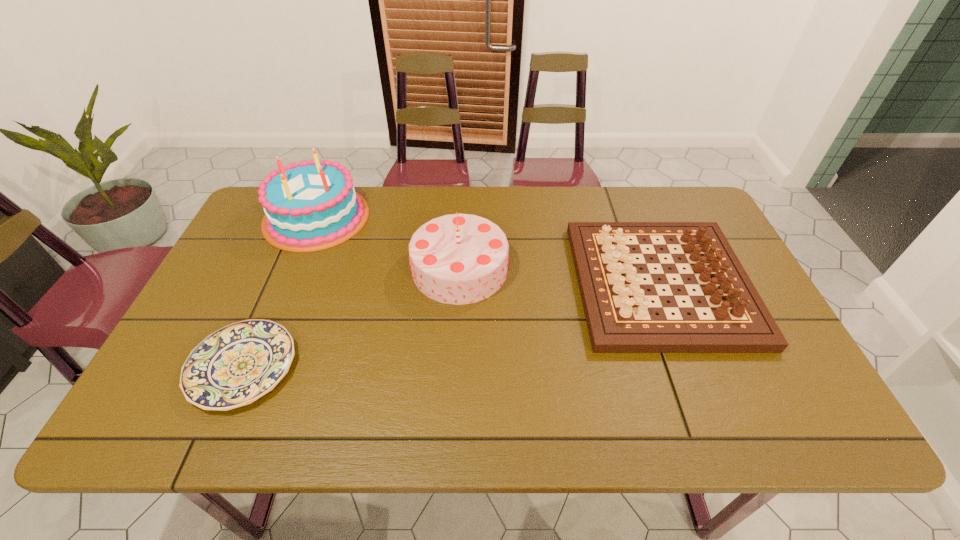
What are the coordinates of `vacant space that satisfies the following two spatial constraints: 1. on the back side of the left birthday cake; 2. on the right side of the plate` in the screenshot? It's located at (308, 217).